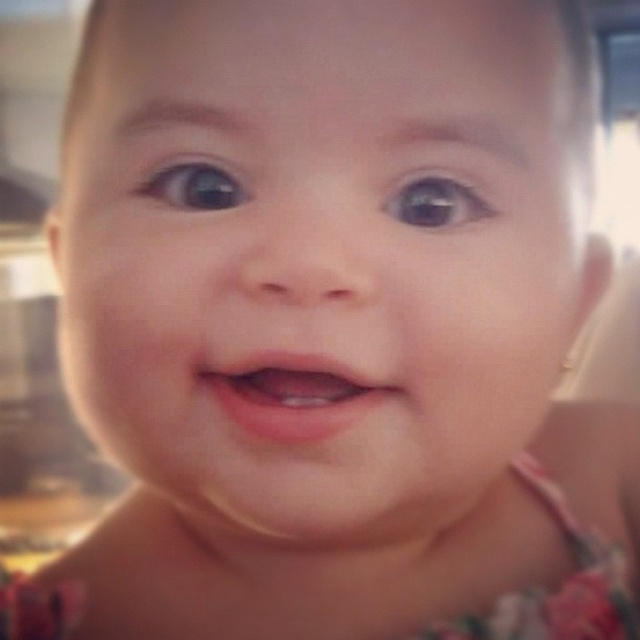
You are a photographer who wants to capture the baby in the image. If you want to focus on the smooth skin baby at center and the brown glossy eye at upper center, which one should you adjust your camera focus to prioritize?

The smooth skin baby at center is positioned under the brown glossy eye at upper center, so adjusting focus to prioritize the smooth skin baby at center would also keep the brown glossy eye at upper center in focus due to their close proximity.